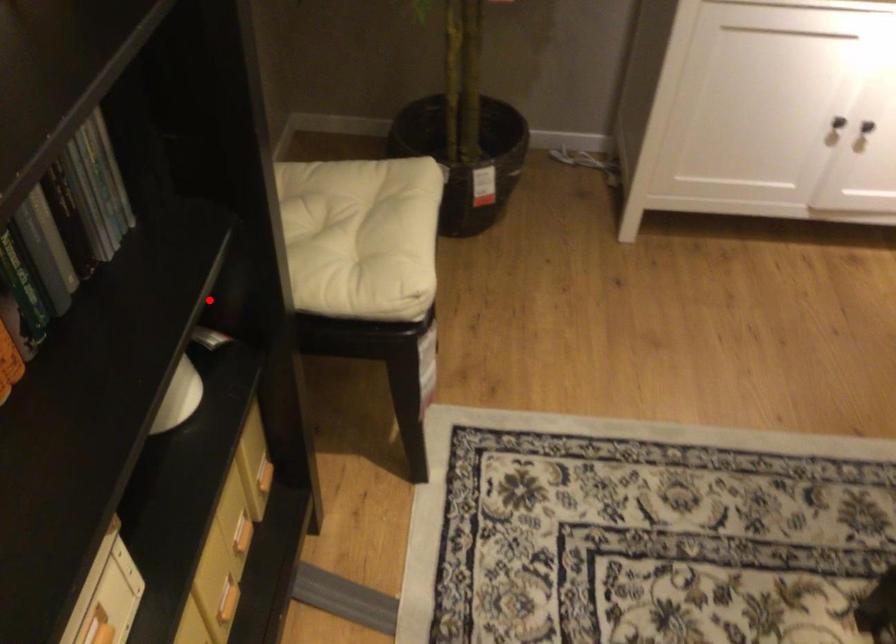
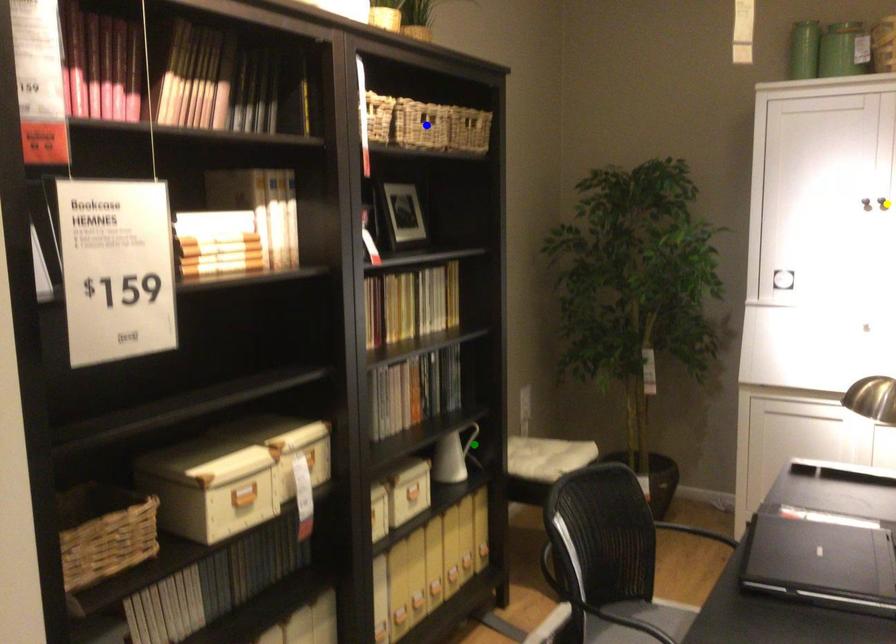
Question: I am providing you with two images of the same scene from different viewpoints. A red point is marked on the first image. You are given multiple points on the second image. Which mark in image 2 goes with the point in image 1?

Choices:
 (A) blue point
 (B) green point
 (C) yellow point

Answer: (B)